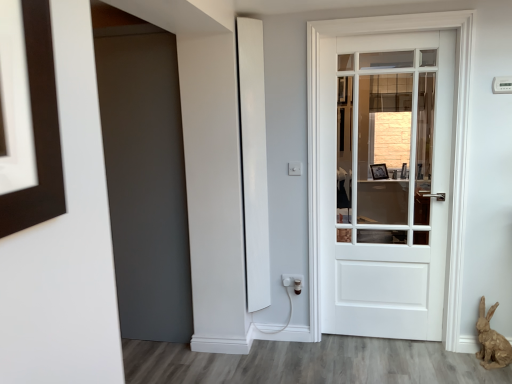
In order to click on white plastic electric outlet at lower center in this screenshot , I will do `click(293, 282)`.

Is white matte door at center shorter than white plastic electric outlet at lower center?

No, white matte door at center is not shorter than white plastic electric outlet at lower center.

Is white matte door at center placed right next to white plastic electric outlet at lower center?

No, white matte door at center is not touching white plastic electric outlet at lower center.

From a real-world perspective, which object rests below the other?

white plastic electric outlet at lower center.

Based on the photo, which object is wider, white matte door at center or white plastic electric outlet at lower center?

Wider between the two is white matte door at center.

Does brown papier-mâché rabbit at lower right come in front of white plastic electric outlet at lower center?

Yes, it is in front of white plastic electric outlet at lower center.

From the picture: From the image's perspective, is brown papier-mâché rabbit at lower right above or below white plastic electric outlet at lower center?

brown papier-mâché rabbit at lower right is situated lower than white plastic electric outlet at lower center in the image.

Considering the relative sizes of brown papier-mâché rabbit at lower right and white plastic electric outlet at lower center in the image provided, is brown papier-mâché rabbit at lower right shorter than white plastic electric outlet at lower center?

Incorrect, the height of brown papier-mâché rabbit at lower right does not fall short of that of white plastic electric outlet at lower center.

Considering the relative sizes of white plastic electric outlet at lower center and brown papier-mâché rabbit at lower right in the image provided, is white plastic electric outlet at lower center smaller than brown papier-mâché rabbit at lower right?

Correct, white plastic electric outlet at lower center occupies less space than brown papier-mâché rabbit at lower right.

Is point (300, 293) positioned behind point (487, 322)?

Yes, point (300, 293) is farther from viewer.

Is white plastic electric outlet at lower center inside or outside of brown papier-mâché rabbit at lower right?

white plastic electric outlet at lower center is not enclosed by brown papier-mâché rabbit at lower right.

In the image, is white plastic electric outlet at lower center positioned in front of or behind brown papier-mâché rabbit at lower right?

Visually, white plastic electric outlet at lower center is located behind brown papier-mâché rabbit at lower right.

Considering the sizes of white matte door at center and brown papier-mâché rabbit at lower right in the image, is white matte door at center bigger or smaller than brown papier-mâché rabbit at lower right?

Clearly, white matte door at center is larger in size than brown papier-mâché rabbit at lower right.

Between white matte door at center and brown papier-mâché rabbit at lower right, which one has smaller width?

With smaller width is white matte door at center.

Looking at this image, can you tell me how much brown papier-mâché rabbit at lower right and white matte door at center differ in facing direction?

1.08 degrees separate the facing orientations of brown papier-mâché rabbit at lower right and white matte door at center.

From a real-world perspective, is brown papier-mâché rabbit at lower right above or below white matte door at center?

Clearly, from a real-world perspective, brown papier-mâché rabbit at lower right is below white matte door at center.

Is brown papier-mâché rabbit at lower right situated inside white matte door at center or outside?

brown papier-mâché rabbit at lower right is spatially situated outside white matte door at center.

Consider the image. How far apart are brown papier-mâché rabbit at lower right and white matte door at center?

brown papier-mâché rabbit at lower right and white matte door at center are 1.73 meters apart from each other.

At what (x,y) coordinates should I click in order to perform the action: click on electric outlet beneath the white matte door at center (from a real-world perspective). Please return your answer as a coordinate pair (x, y). Looking at the image, I should click on (293, 282).

From a real-world perspective, is white plastic electric outlet at lower center beneath white matte door at center?

Yes, from a real-world perspective, white plastic electric outlet at lower center is beneath white matte door at center.

Is white plastic electric outlet at lower center in front of or behind white matte door at center in the image?

Visually, white plastic electric outlet at lower center is located behind white matte door at center.

Is white plastic electric outlet at lower center wider or thinner than white matte door at center?

Considering their sizes, white plastic electric outlet at lower center looks slimmer than white matte door at center.

The height and width of the screenshot is (384, 512). I want to click on door in front of the white plastic electric outlet at lower center, so click(x=386, y=183).

Find the location of `electric outlet that appears above the brown papier-mâché rabbit at lower right (from a real-world perspective)`. electric outlet that appears above the brown papier-mâché rabbit at lower right (from a real-world perspective) is located at coordinates (293, 282).

From the image, which object appears to be nearer to white plastic electric outlet at lower center, white matte door at center or brown papier-mâché rabbit at lower right?

The object closer to white plastic electric outlet at lower center is brown papier-mâché rabbit at lower right.

Estimate the real-world distances between objects in this image. Which object is further from brown papier-mâché rabbit at lower right, white matte door at center or white plastic electric outlet at lower center?

white matte door at center.

When comparing their distances from white plastic electric outlet at lower center, does brown papier-mâché rabbit at lower right or white matte door at center seem closer?

brown papier-mâché rabbit at lower right lies closer to white plastic electric outlet at lower center than the other object.

Based on their spatial positions, is white plastic electric outlet at lower center or white matte door at center further from brown papier-mâché rabbit at lower right?

The object further to brown papier-mâché rabbit at lower right is white matte door at center.

From the image, which object appears to be farther from white matte door at center, white plastic electric outlet at lower center or brown papier-mâché rabbit at lower right?

The object further to white matte door at center is white plastic electric outlet at lower center.

From the image, which object appears to be nearer to white matte door at center, brown papier-mâché rabbit at lower right or white plastic electric outlet at lower center?

brown papier-mâché rabbit at lower right is positioned closer to the anchor white matte door at center.

This screenshot has height=384, width=512. What are the coordinates of `door between white plastic electric outlet at lower center and brown papier-mâché rabbit at lower right from left to right` in the screenshot? It's located at (386, 183).